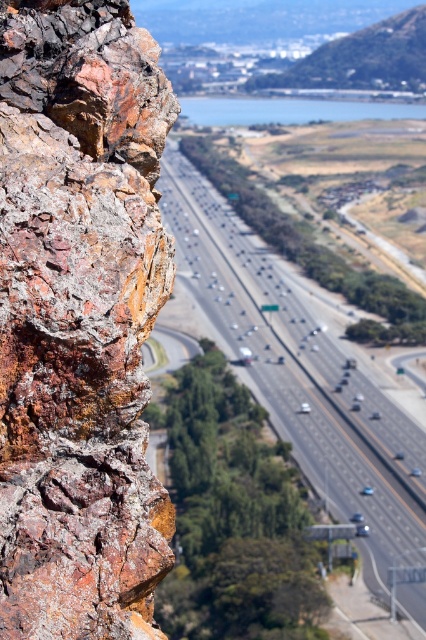
You are a drone operator tasked with capturing aerial footage of the highway. Your drone is currently hovering at point (302,369). What is the terrain type directly beneath your drone?

The terrain type directly beneath the drone at point (302,369) is smooth asphalt highway at center.

You are a drone operator flying a drone over the scene. You need to capture a photo of both the rusty rock at left and the smooth asphalt highway at center. Which object should you adjust your drone to focus on first to ensure both are in frame?

The rusty rock at left is closer to the viewer than the smooth asphalt highway at center. To ensure both are in frame, you should focus on the rusty rock at left first, as it is nearer and adjusting the drone to include it will naturally bring the highway into the background.

Based on the photo, you are a drone operator who needs to capture a photo of the rusty rock at left and the green grassy hill at upper right. Which object should you position the drone closer to in order to ensure both are visible in the frame?

Since the rusty rock at left is smaller in size compared to the green grassy hill at upper right, you should position the drone closer to the rusty rock at left to ensure both objects are visible in the frame.